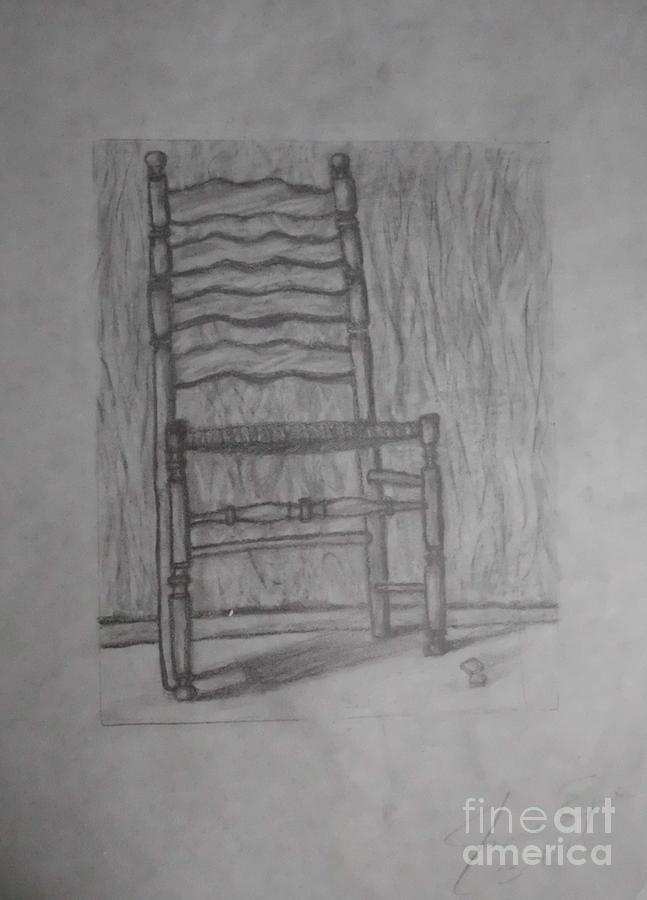
Where is `textured wall background`? Image resolution: width=647 pixels, height=900 pixels. textured wall background is located at coordinates (421, 325).